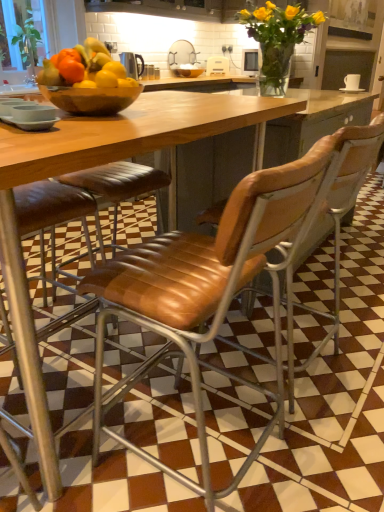
Question: Is yellow matte vase at upper center, positioned as the 2th flower in front-to-back order, to the left or to the right of metallic silver kettle at center in the image?

Choices:
 (A) right
 (B) left

Answer: (A)

Question: Looking at the image, does yellow matte vase at upper center, placed as the 1th flower when sorted from top to bottom, seem bigger or smaller compared to metallic silver kettle at center?

Choices:
 (A) small
 (B) big

Answer: (B)

Question: Considering the real-world distances, which object is farthest from the brown leather chair at center, the first chair from the left?

Choices:
 (A) wooden bowl at center
 (B) leather seat at center, placed as the first chair when sorted from right to left
 (C) yellow matte vase at upper center, positioned as the 2th flower in front-to-back order
 (D) transparent glass bowl at center
 (E) yellow glass vase at upper center, which ranks as the second flower in back-to-front order

Answer: (D)

Question: Which is nearer to the wooden bowl at center?

Choices:
 (A) leather seat at center, placed as the first chair when sorted from right to left
 (B) metallic silver kettle at center
 (C) brown leather chair at center, which is the 2th chair from right to left
 (D) yellow matte vase at upper center, the 1th flower in the back-to-front sequence
 (E) transparent glass bowl at center

Answer: (C)